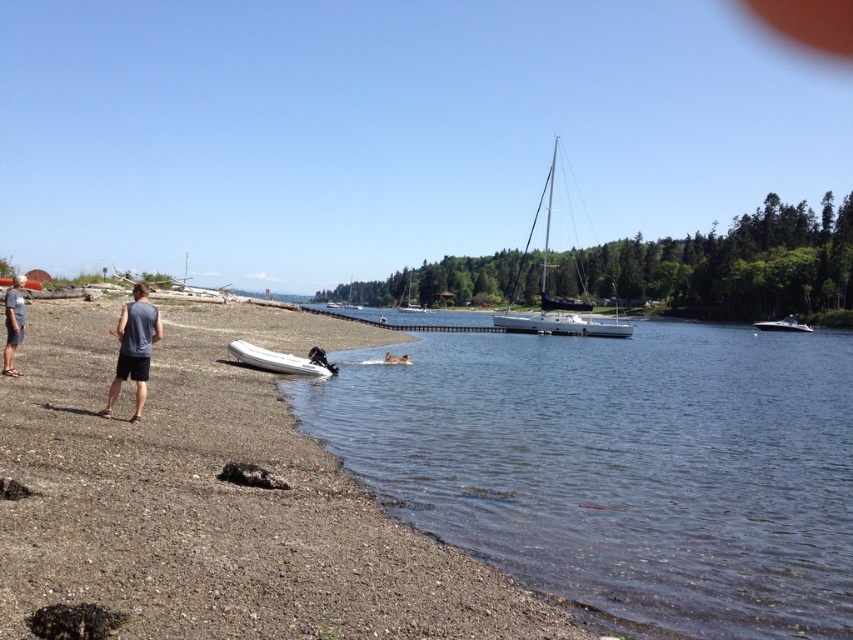
Question: Estimate the real-world distances between objects in this image. Which object is closer to the brown leather dog at lower center?

Choices:
 (A) white plastic canoe at lower left
 (B) brown gravelly sand at lower left
 (C) white matte boat at center
 (D) white glossy speedboat at lower right

Answer: (A)

Question: Is white glossy speedboat at lower right below white matte sailboat at center?

Choices:
 (A) no
 (B) yes

Answer: (B)

Question: Does white matte sailboat at center appear on the right side of brown leather dog at lower center?

Choices:
 (A) no
 (B) yes

Answer: (A)

Question: Which point is closer to the camera taking this photo?

Choices:
 (A) (305, 369)
 (B) (386, 360)
 (C) (412, 308)
 (D) (99, 413)

Answer: (D)

Question: Considering the real-world distances, which object is farthest from the gray fabric shirt at lower left?

Choices:
 (A) white glossy sailboat at center
 (B) white matte sailboat at center

Answer: (B)

Question: Is gray sleeveless shirt at left positioned before white matte boat at center?

Choices:
 (A) no
 (B) yes

Answer: (B)